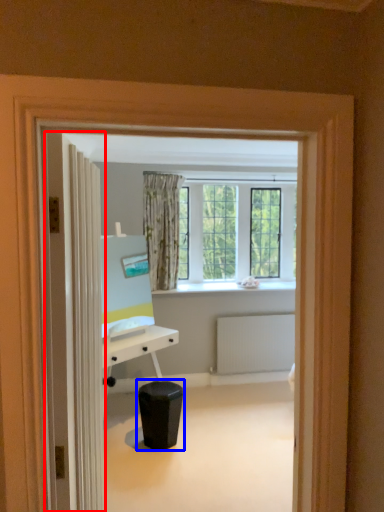
Question: Which object is further to the camera taking this photo, door (highlighted by a red box) or music stool (highlighted by a blue box)?

Choices:
 (A) door
 (B) music stool

Answer: (B)